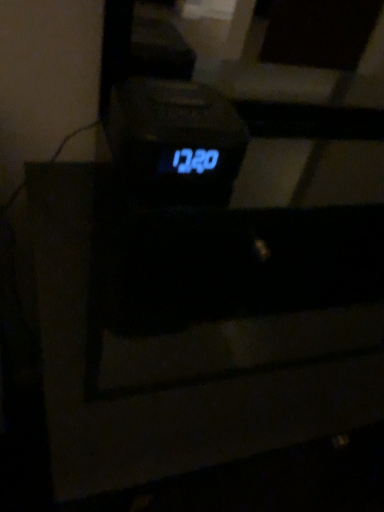
Question: Looking at their shapes, would you say blue led display at center is wider or thinner than black plastic drawer at center?

Choices:
 (A) wide
 (B) thin

Answer: (B)

Question: Based on their sizes in the image, would you say blue led display at center is bigger or smaller than black plastic drawer at center?

Choices:
 (A) small
 (B) big

Answer: (A)

Question: From their relative heights in the image, would you say blue led display at center is taller or shorter than black plastic drawer at center?

Choices:
 (A) short
 (B) tall

Answer: (A)

Question: Is point (59, 357) positioned closer to the camera than point (188, 122)?

Choices:
 (A) closer
 (B) farther

Answer: (B)

Question: Looking at their shapes, would you say black plastic drawer at center is wider or thinner than blue led display at center?

Choices:
 (A) thin
 (B) wide

Answer: (B)

Question: Considering the relative positions of black plastic drawer at center and blue led display at center in the image provided, is black plastic drawer at center to the left or to the right of blue led display at center?

Choices:
 (A) left
 (B) right

Answer: (B)

Question: Is black plastic drawer at center bigger or smaller than blue led display at center?

Choices:
 (A) big
 (B) small

Answer: (A)